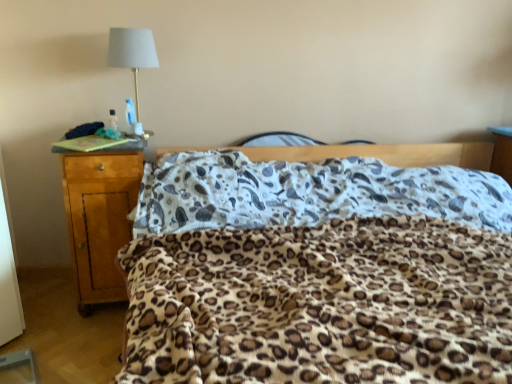
Question: Does point (437, 324) appear closer or farther from the camera than point (113, 52)?

Choices:
 (A) closer
 (B) farther

Answer: (A)

Question: In the image, is leopard print blanket at center positioned in front of or behind white fabric lampshade at upper left?

Choices:
 (A) front
 (B) behind

Answer: (A)

Question: Estimate the real-world distances between objects in this image. Which object is closer to the light brown wood nightstand at left?

Choices:
 (A) leopard print blanket at center
 (B) white fabric lampshade at upper left

Answer: (B)

Question: Considering the real-world distances, which object is farthest from the leopard print blanket at center?

Choices:
 (A) light brown wood nightstand at left
 (B) white fabric lampshade at upper left

Answer: (B)